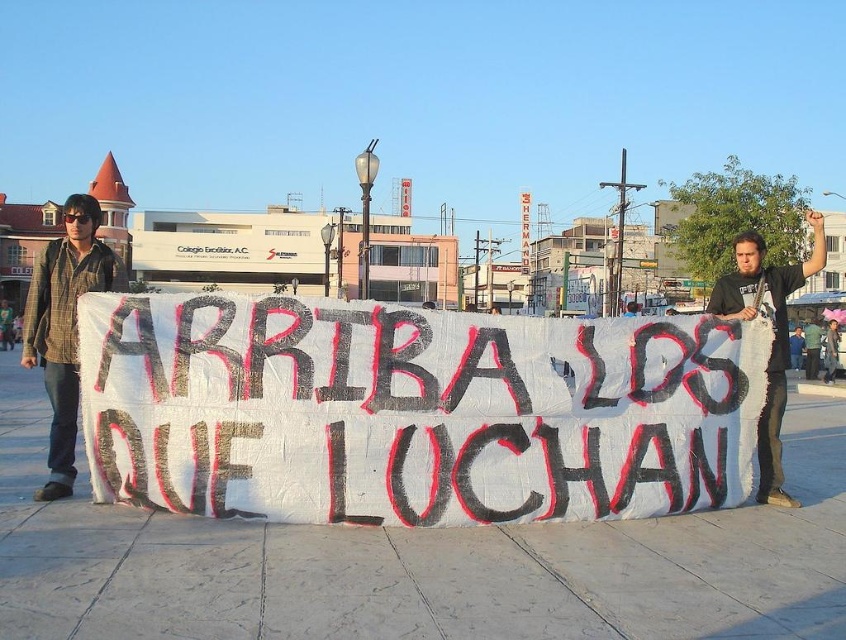
Question: Which of the following is the closest to the observer?

Choices:
 (A) (63, 337)
 (B) (816, 337)
 (C) (665, 401)

Answer: (A)

Question: Is white paper banner at center wider than black t-shirt at center?

Choices:
 (A) yes
 (B) no

Answer: (B)

Question: Is white paper banner at center above plaid shirt at left?

Choices:
 (A) yes
 (B) no

Answer: (B)

Question: Is black t-shirt at center below green fabric shirt at center?

Choices:
 (A) no
 (B) yes

Answer: (A)

Question: Which object is positioned closest to the green fabric shirt at center?

Choices:
 (A) white paper banner at center
 (B) plaid shirt at left

Answer: (A)

Question: Among these points, which one is farthest from the camera?

Choices:
 (A) (239, 337)
 (B) (66, 448)
 (C) (779, 372)

Answer: (C)